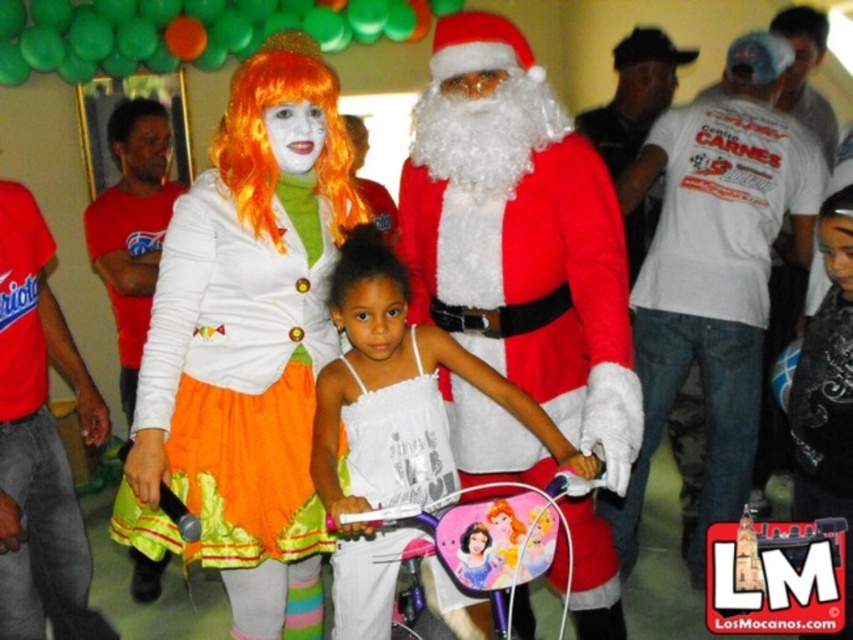
Question: Which point is farther to the camera?

Choices:
 (A) matte red shirt at left
 (B) orange synthetic wig at upper center

Answer: (A)

Question: Where is matte orange dress at center located in relation to white lace dress at center in the image?

Choices:
 (A) below
 (B) above

Answer: (B)

Question: Estimate the real-world distances between objects in this image. Which object is farther from the purple metallic bicycle at center?

Choices:
 (A) matte red shirt at left
 (B) matte orange dress at center
 (C) red t-shirt at left
 (D) white lace dress at center

Answer: (A)

Question: Does white lace dress at center appear under purple metallic bicycle at center?

Choices:
 (A) yes
 (B) no

Answer: (B)

Question: Which object appears closest to the camera in this image?

Choices:
 (A) white cotton tank top at center
 (B) orange synthetic wig at upper center
 (C) matte orange dress at center
 (D) purple metallic bicycle at center

Answer: (D)

Question: Is white cotton t-shirt at center further to camera compared to orange synthetic wig at upper center?

Choices:
 (A) no
 (B) yes

Answer: (B)